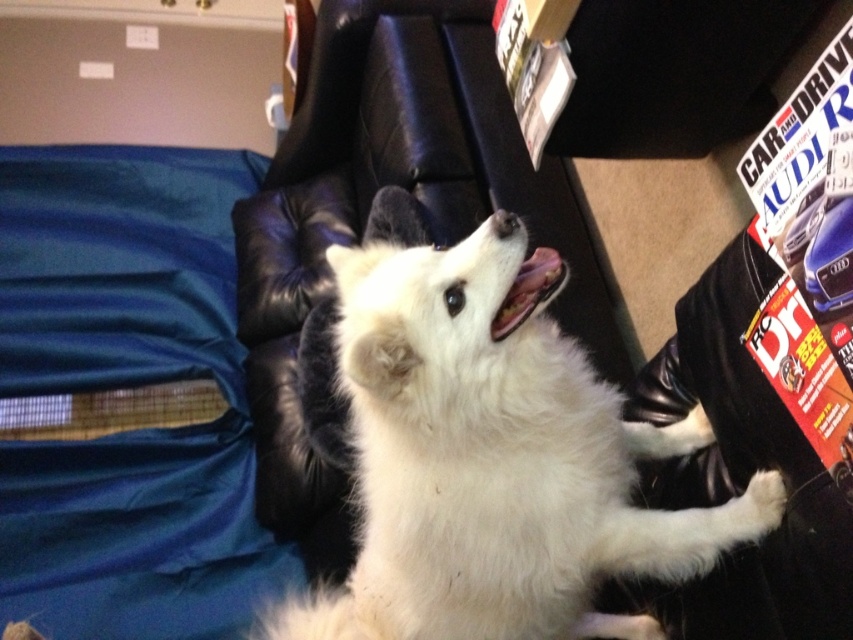
Who is taller, white fluffy dog at center or black leather magazine rack at upper right?

Standing taller between the two is white fluffy dog at center.

You are a GUI agent. You are given a task and a screenshot of the screen. Output one action in this format:
    pyautogui.click(x=<x>, y=<y>)
    Task: Click on the white fluffy dog at center
    
    Given the screenshot: What is the action you would take?
    pyautogui.click(x=488, y=451)

Between point (570, 408) and point (727, 132), which one is positioned behind?

The point (727, 132) is behind.

The height and width of the screenshot is (640, 853). What are the coordinates of `white fluffy dog at center` in the screenshot? It's located at (488, 451).